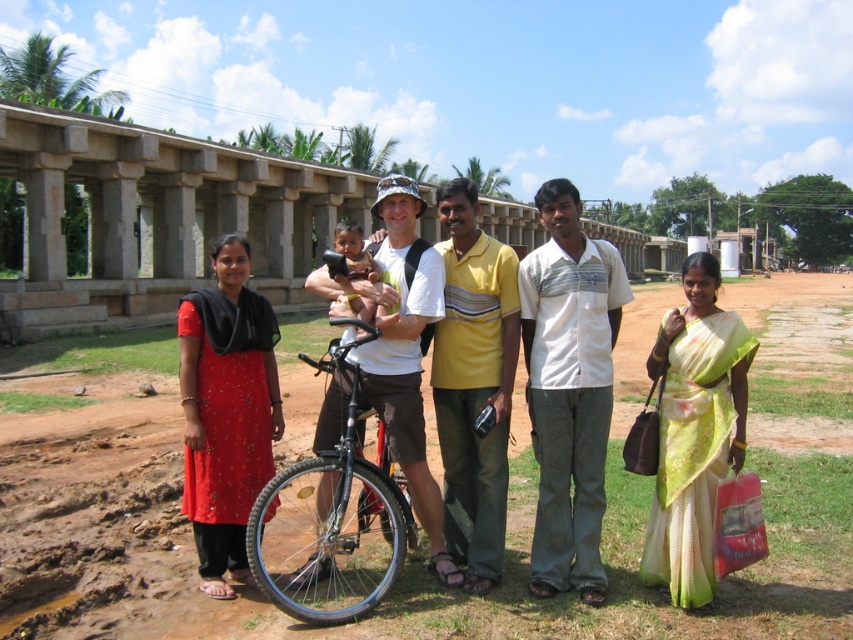
Question: Is white striped shirt at center to the right of soft yellow skin at center from the viewer's perspective?

Choices:
 (A) no
 (B) yes

Answer: (B)

Question: Does matte white bicycle at center appear on the right side of matte white shirt at center?

Choices:
 (A) yes
 (B) no

Answer: (A)

Question: Which point is closer to the camera?

Choices:
 (A) black matte bicycle at center
 (B) matte white shirt at center

Answer: (A)

Question: In this image, where is matte white bicycle at center located relative to yellow striped shirt at center?

Choices:
 (A) right
 (B) left

Answer: (B)

Question: Which is farther from the yellow striped shirt at center?

Choices:
 (A) matte white shirt at center
 (B) black matte bicycle at center
 (C) matte white bicycle at center
 (D) soft yellow skin at center

Answer: (A)

Question: Which of these objects is positioned closest to the black matte bicycle at center?

Choices:
 (A) white striped shirt at center
 (B) soft yellow skin at center
 (C) yellow striped shirt at center
 (D) matte white shirt at center

Answer: (C)